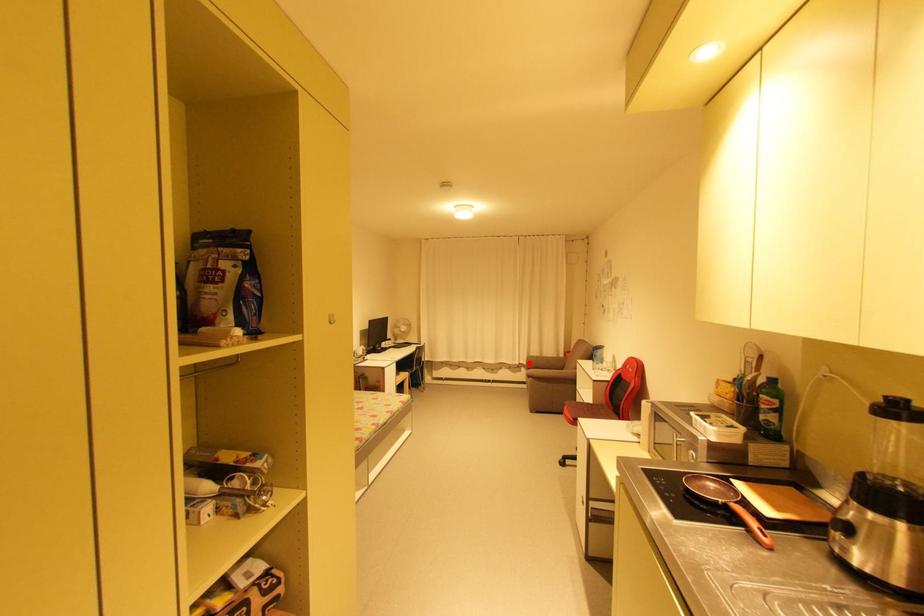
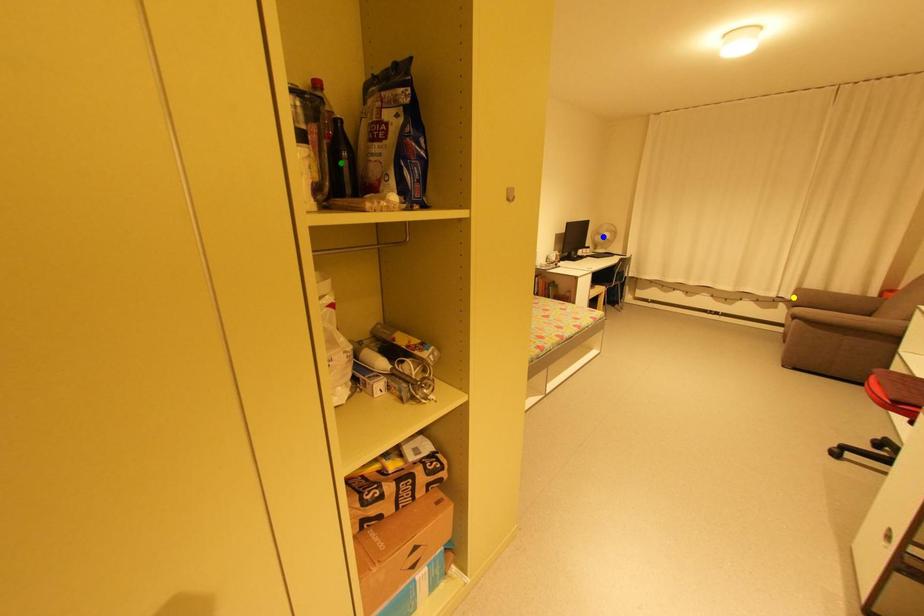
Question: I am providing you with two images of the same scene from different viewpoints. A red point is marked on the first image. You are given multiple points on the second image. In image 2, which mark is for the same physical point as the one in image 1?

Choices:
 (A) green point
 (B) blue point
 (C) yellow point

Answer: (C)